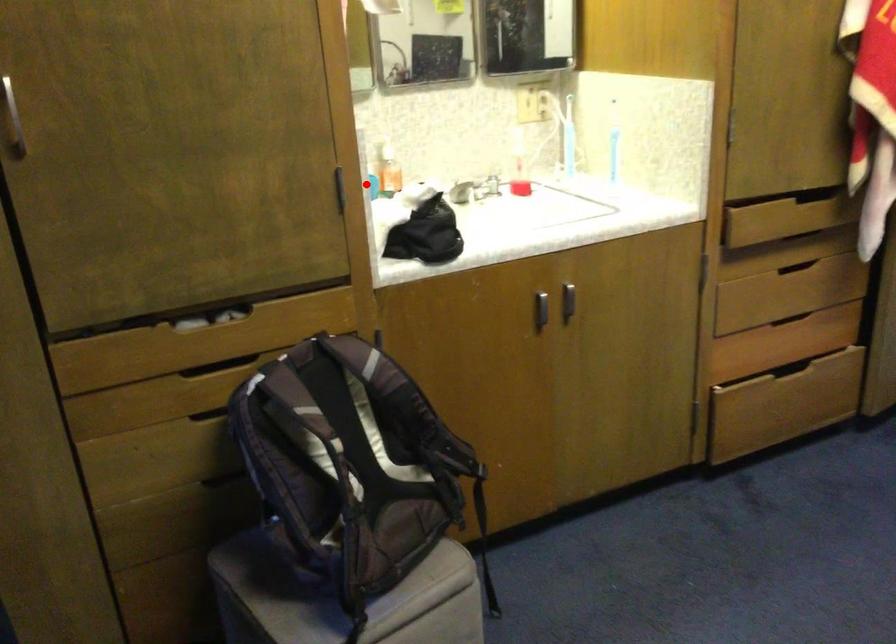
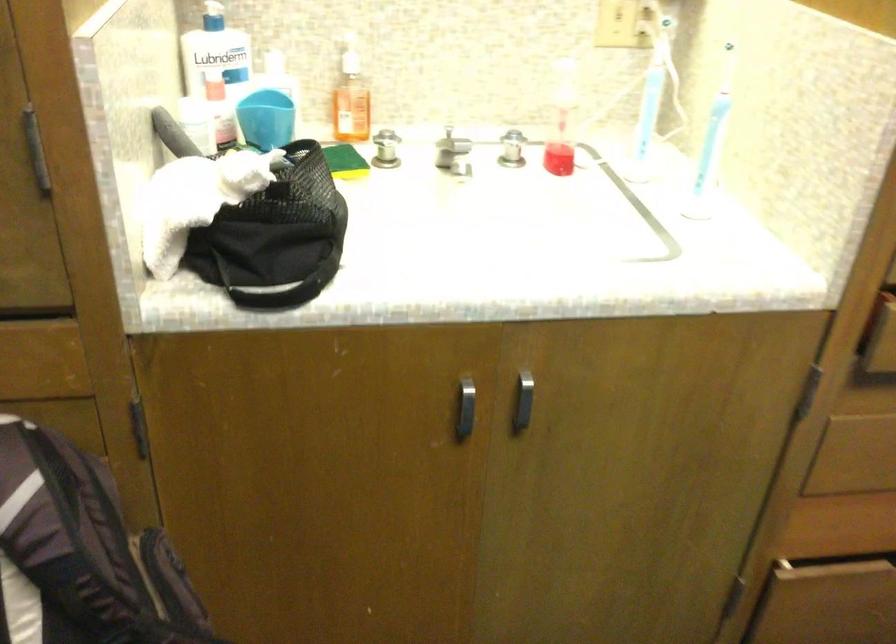
Question: I am providing you with two images of the same scene from different viewpoints. A red point is marked on the first image. Is the red point's position out of view in image 2?

Choices:
 (A) Yes
 (B) No

Answer: (B)